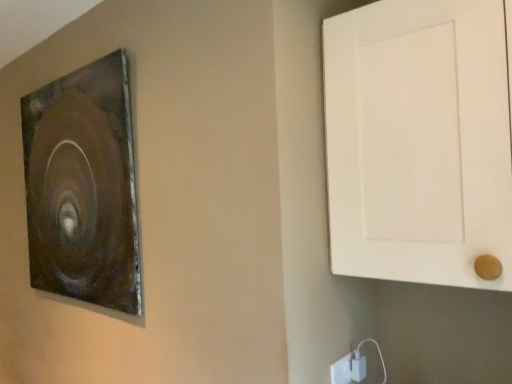
This screenshot has height=384, width=512. What do you see at coordinates (349, 369) in the screenshot?
I see `white plastic electric outlet at lower right` at bounding box center [349, 369].

Identify the location of white plastic electric outlet at lower right. The height and width of the screenshot is (384, 512). point(349,369).

The width and height of the screenshot is (512, 384). Find the location of `metallic brown picture frame at upper left`. metallic brown picture frame at upper left is located at coordinates (83, 187).

Measure the distance between white plastic electric outlet at lower right and white matte door at right.

A distance of 25.20 inches exists between white plastic electric outlet at lower right and white matte door at right.

Is white matte door at right at the back of white plastic electric outlet at lower right?

No, white plastic electric outlet at lower right's orientation is not away from white matte door at right.

Does white plastic electric outlet at lower right have a lesser height compared to white matte door at right?

Correct, white plastic electric outlet at lower right is not as tall as white matte door at right.

Considering the relative positions of white plastic electric outlet at lower right and white matte door at right in the image provided, is white plastic electric outlet at lower right to the left or to the right of white matte door at right?

In the image, white plastic electric outlet at lower right appears on the left side of white matte door at right.

Would you say white plastic electric outlet at lower right is a long distance from metallic brown picture frame at upper left?

That's right, there is a large distance between white plastic electric outlet at lower right and metallic brown picture frame at upper left.

Which object is thinner, white plastic electric outlet at lower right or metallic brown picture frame at upper left?

With smaller width is white plastic electric outlet at lower right.

Between white plastic electric outlet at lower right and metallic brown picture frame at upper left, which one has larger size?

metallic brown picture frame at upper left is bigger.

Between point (362, 359) and point (63, 293), which one is positioned behind?

The point (63, 293) is farther from the camera.

Is white matte door at right far away from metallic brown picture frame at upper left?

That's not correct — white matte door at right is a little close to metallic brown picture frame at upper left.

Is the position of white matte door at right less distant than that of metallic brown picture frame at upper left?

Yes.

From their relative heights in the image, would you say white matte door at right is taller or shorter than metallic brown picture frame at upper left?

white matte door at right is shorter than metallic brown picture frame at upper left.

Where is `picture frame to the left of white matte door at right`? picture frame to the left of white matte door at right is located at coordinates (83, 187).

From the image's perspective, between metallic brown picture frame at upper left and white matte door at right, who is located below?

metallic brown picture frame at upper left appears lower in the image.

Could you tell me if metallic brown picture frame at upper left is turned towards white matte door at right?

No, metallic brown picture frame at upper left does not turn towards white matte door at right.

Identify the location of picture frame below the white matte door at right (from a real-world perspective). (83, 187).

Who is shorter, metallic brown picture frame at upper left or white plastic electric outlet at lower right?

white plastic electric outlet at lower right.

Are metallic brown picture frame at upper left and white plastic electric outlet at lower right making contact?

metallic brown picture frame at upper left is not next to white plastic electric outlet at lower right, and they're not touching.

Is metallic brown picture frame at upper left oriented towards white plastic electric outlet at lower right?

No, metallic brown picture frame at upper left is not turned towards white plastic electric outlet at lower right.

From the picture: From the image's perspective, is metallic brown picture frame at upper left under white plastic electric outlet at lower right?

No, from the image's perspective, metallic brown picture frame at upper left is not below white plastic electric outlet at lower right.

Is white matte door at right in front of or behind white plastic electric outlet at lower right in the image?

white matte door at right is positioned closer to the viewer than white plastic electric outlet at lower right.

Does white matte door at right have a lesser height compared to white plastic electric outlet at lower right?

No.

Is white matte door at right not close to white plastic electric outlet at lower right?

No, white matte door at right is in close proximity to white plastic electric outlet at lower right.

Is white matte door at right not inside white plastic electric outlet at lower right?

Indeed, white matte door at right is completely outside white plastic electric outlet at lower right.

This screenshot has height=384, width=512. Find the location of `electric outlet behind the white matte door at right`. electric outlet behind the white matte door at right is located at coordinates (349, 369).

The image size is (512, 384). What are the coordinates of `picture frame that is above the white plastic electric outlet at lower right (from the image's perspective)` in the screenshot? It's located at (83, 187).

Based on their spatial positions, is white matte door at right or white plastic electric outlet at lower right further from metallic brown picture frame at upper left?

Based on the image, white plastic electric outlet at lower right appears to be further to metallic brown picture frame at upper left.

Which object lies further to the anchor point white matte door at right, white plastic electric outlet at lower right or metallic brown picture frame at upper left?

The object further to white matte door at right is metallic brown picture frame at upper left.

Which object lies further to the anchor point metallic brown picture frame at upper left, white plastic electric outlet at lower right or white matte door at right?

white plastic electric outlet at lower right.

Considering their positions, is white matte door at right positioned further to white plastic electric outlet at lower right than metallic brown picture frame at upper left?

Based on the image, metallic brown picture frame at upper left appears to be further to white plastic electric outlet at lower right.

When comparing their distances from white matte door at right, does metallic brown picture frame at upper left or white plastic electric outlet at lower right seem further?

metallic brown picture frame at upper left.

Estimate the real-world distances between objects in this image. Which object is closer to white plastic electric outlet at lower right, metallic brown picture frame at upper left or white matte door at right?

Based on the image, white matte door at right appears to be nearer to white plastic electric outlet at lower right.

Locate an element on the screen. The width and height of the screenshot is (512, 384). electric outlet between metallic brown picture frame at upper left and white matte door at right from left to right is located at coordinates coord(349,369).